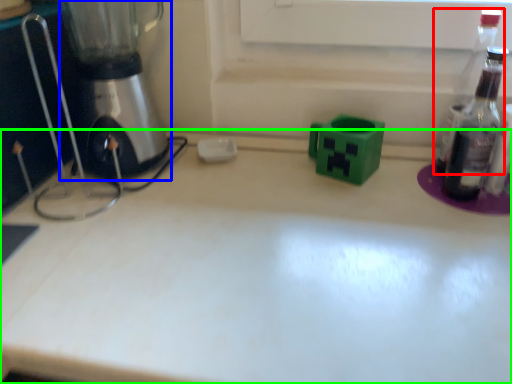
Question: Which is farther away from bottle (highlighted by a red box)? mixer (highlighted by a blue box) or countertop (highlighted by a green box)?

Choices:
 (A) mixer
 (B) countertop

Answer: (A)